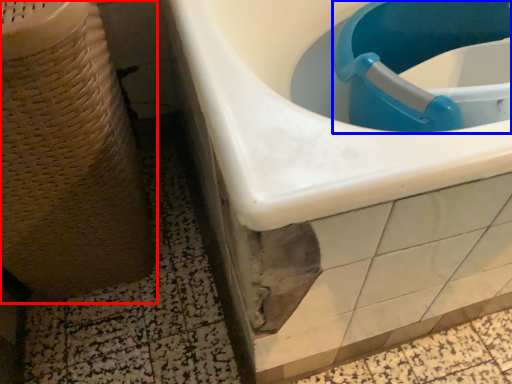
Question: Which of the following is the farthest to the observer, potty (highlighted by a red box) or sink (highlighted by a blue box)?

Choices:
 (A) potty
 (B) sink

Answer: (B)